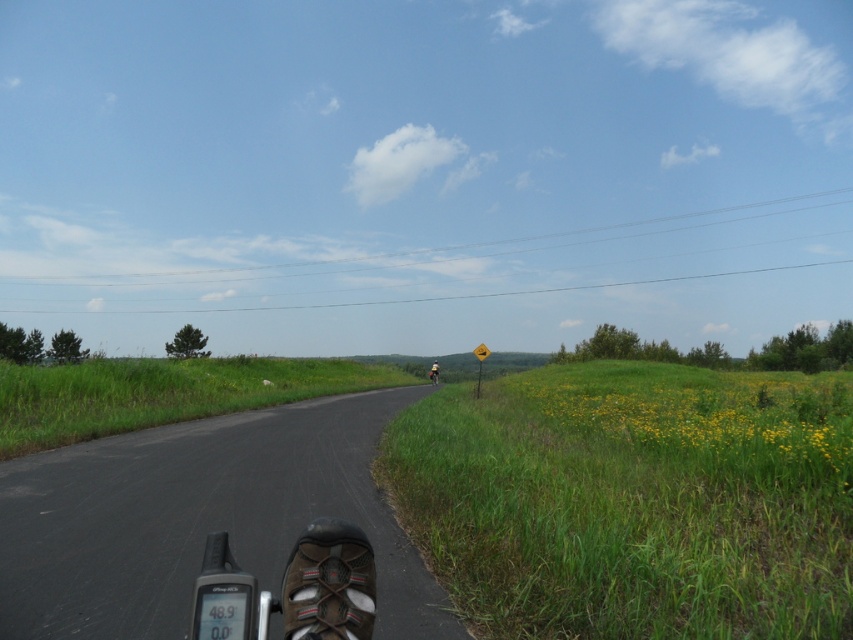
You are riding a bicycle along the road and see a point marked at coordinates (634, 500). Based on the scene description, what is the location of this point relative to the road and the cyclist?

The point marked at coordinates (634, 500) indicates a green grassy hillside located to the right of the road, away from the cyclist who is positioned near the road and a yellow road sign.

As a cyclist approaching the yellow road sign, you notice a point marked at coordinates (634,500). Based on the scene, where is this point located relative to the road?

The point is on the green grassy hillside at the right side of the road.

In the scene shown: You are riding a bicycle on the road and see two points marked on the road ahead. The first point is at coordinate point [759,595] and the second point is at coordinate point [433,384]. Which point will you reach first as you continue riding forward?

Point [759,595] is closer to the viewer than point [433,384], so you will reach point [759,595] first.